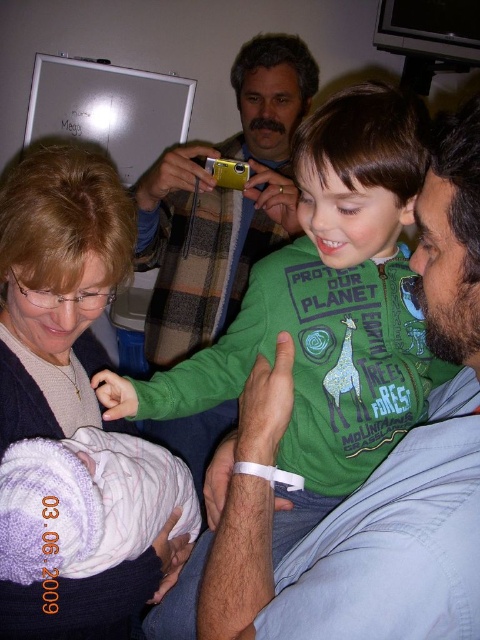
Question: Is green matte shirt at center to the right of matte gray sweater at upper left from the viewer's perspective?

Choices:
 (A) yes
 (B) no

Answer: (A)

Question: Can you confirm if green matte shirt at center is smaller than white swaddled baby at lower left?

Choices:
 (A) yes
 (B) no

Answer: (B)

Question: Estimate the real-world distances between objects in this image. Which object is closer to the white swaddled baby at lower left?

Choices:
 (A) green matte shirt at center
 (B) matte gray sweater at upper left

Answer: (B)

Question: Which object is positioned closest to the green matte shirt at center?

Choices:
 (A) white swaddled baby at lower left
 (B) matte gray sweater at upper left

Answer: (A)

Question: Is matte gray sweater at upper left positioned in front of white swaddled baby at lower left?

Choices:
 (A) yes
 (B) no

Answer: (B)

Question: Estimate the real-world distances between objects in this image. Which object is closer to the green matte shirt at center?

Choices:
 (A) matte gray sweater at upper left
 (B) white swaddled baby at lower left

Answer: (B)